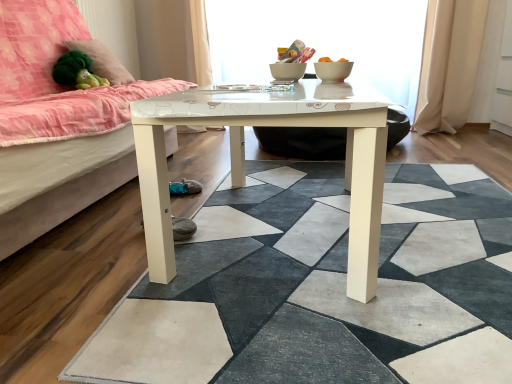
This screenshot has width=512, height=384. Identify the location of vacant location below white glossy table at center (from a real-world perspective). (322, 210).